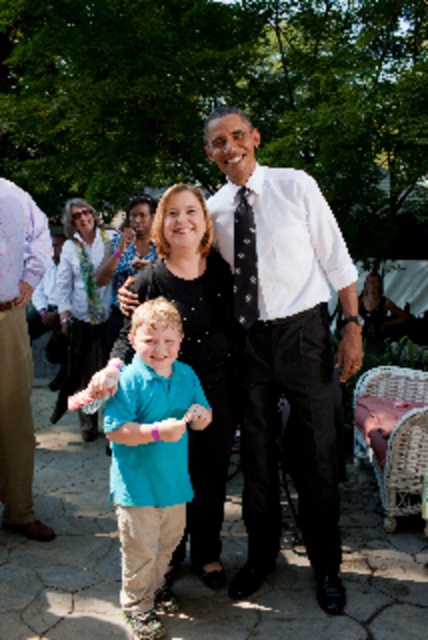
Question: Which object is the closest to the white satin scarf at upper left?

Choices:
 (A) white shirt at center
 (B) teal cotton shirt at center
 (C) white textured shirt at center

Answer: (C)

Question: Estimate the real-world distances between objects in this image. Which object is farther from the teal cotton shirt at center?

Choices:
 (A) white satin scarf at upper left
 (B) black dotted tie at center
 (C) white textured shirt at center

Answer: (A)

Question: Is white textured shirt at center behind teal cotton shirt at center?

Choices:
 (A) no
 (B) yes

Answer: (B)

Question: Which of the following is the closest to the observer?

Choices:
 (A) black dotted tie at center
 (B) white satin scarf at upper left
 (C) white textured shirt at center

Answer: (C)

Question: Is white textured shirt at center positioned in front of teal cotton shirt at center?

Choices:
 (A) yes
 (B) no

Answer: (B)

Question: Does light purple fabric at left appear over black dotted tie at center?

Choices:
 (A) no
 (B) yes

Answer: (A)